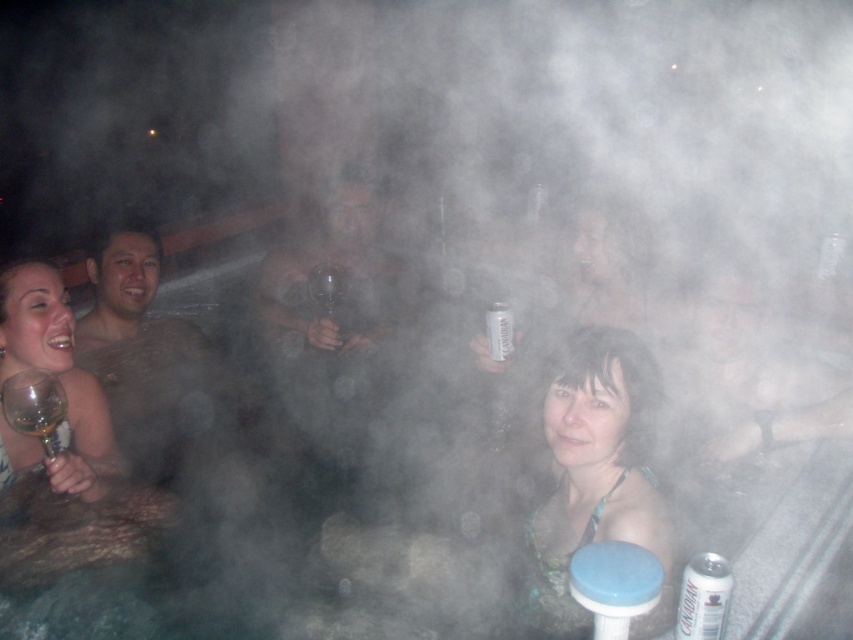
Is matte white wine glass at left wider than translucent glass wine glass at lower left?

Yes, matte white wine glass at left is wider than translucent glass wine glass at lower left.

Based on the photo, is matte white wine glass at left above translucent glass wine glass at lower left?

Indeed, matte white wine glass at left is positioned over translucent glass wine glass at lower left.

Locate an element on the screen. matte white wine glass at left is located at coordinates (59, 381).

This screenshot has height=640, width=853. In order to click on matte white wine glass at left in this screenshot , I will do `click(59, 381)`.

Is matte white wine glass at left positioned before silver metallic can at center?

Yes.

Can you confirm if matte white wine glass at left is bigger than silver metallic can at center?

Indeed, matte white wine glass at left has a larger size compared to silver metallic can at center.

Identify the location of matte white wine glass at left. The width and height of the screenshot is (853, 640). (59, 381).

Looking at this image, who is more forward, (631, 348) or (503, 314)?

Point (631, 348) is in front.

Can you confirm if matte green bikini top at center is positioned to the right of silver metallic can at center?

Indeed, matte green bikini top at center is positioned on the right side of silver metallic can at center.

This screenshot has width=853, height=640. Find the location of `matte green bikini top at center`. matte green bikini top at center is located at coordinates click(x=595, y=467).

Locate an element on the screen. The height and width of the screenshot is (640, 853). matte green bikini top at center is located at coordinates (595, 467).